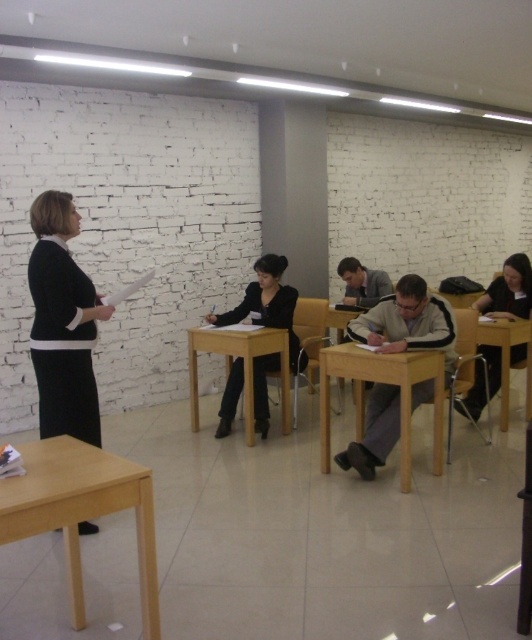
Is black fabric jacket at lower right above brown wooden chair at center?

Yes.

Does black fabric jacket at lower right appear on the left side of brown wooden chair at center?

No, black fabric jacket at lower right is not to the left of brown wooden chair at center.

Between point (494, 282) and point (310, 312), which one is positioned in front?

Point (494, 282) is more forward.

Find the location of a particular element. The height and width of the screenshot is (640, 532). black fabric jacket at lower right is located at coordinates (509, 291).

Which is more to the left, black matte jacket at center or wooden table at center?

Positioned to the left is wooden table at center.

Between black matte jacket at center and wooden table at center, which one is positioned lower?

wooden table at center is lower down.

Between point (219, 435) and point (250, 356), which one is positioned in front?

Point (250, 356)

The width and height of the screenshot is (532, 640). In order to click on black matte jacket at center in this screenshot , I will do `click(267, 301)`.

Who is taller, black fabric jacket at lower right or wooden chair at center?

Answer: With more height is black fabric jacket at lower right.

The image size is (532, 640). What do you see at coordinates (509, 291) in the screenshot?
I see `black fabric jacket at lower right` at bounding box center [509, 291].

The image size is (532, 640). Find the location of `black fabric jacket at lower right`. black fabric jacket at lower right is located at coordinates (509, 291).